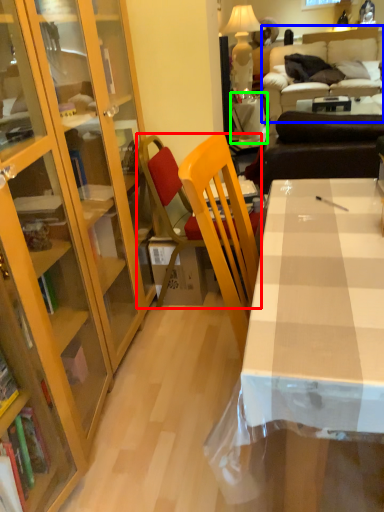
Question: Which object is the farthest from chair (highlighted by a red box)? Choose among these: studio couch (highlighted by a blue box) or table (highlighted by a green box).

Choices:
 (A) studio couch
 (B) table

Answer: (A)